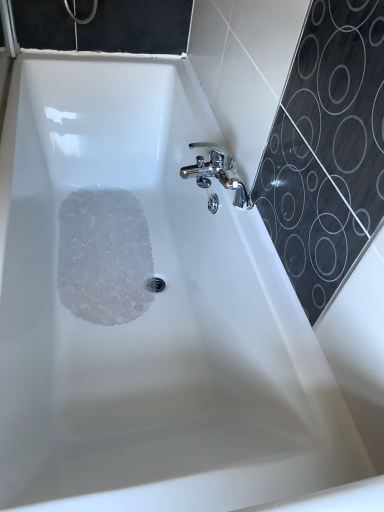
Image resolution: width=384 pixels, height=512 pixels. What are the coordinates of `translucent plastic beads at bottom` in the screenshot? It's located at (104, 256).

Describe the element at coordinates (104, 256) in the screenshot. I see `translucent plastic beads at bottom` at that location.

Where is `translucent plastic beads at bottom`? translucent plastic beads at bottom is located at coordinates pos(104,256).